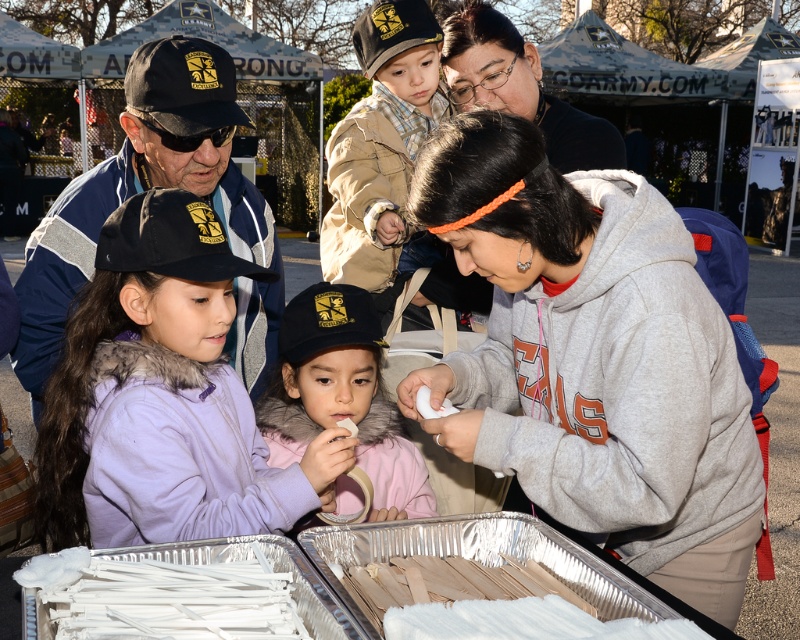
You are a photographer trying to capture a photo of the gray fleece hoodie at center and the black matte cap at upper left. Which object should you zoom in on to ensure both are clearly visible in the frame?

The gray fleece hoodie at center is smaller than the black matte cap at upper left, so you should zoom in on the smaller gray fleece hoodie at center to ensure both fit clearly in the frame.

You are a participant at the event and want to grab the white plastic straws at lower center to hand out drinks. However, you need to reach them while standing behind the matte black hoodie at upper center. Can you easily access the straws without moving the hoodie?

The white plastic straws at lower center are positioned on the left side of the matte black hoodie at upper center, so you can reach them by moving to the left side of the hoodie without needing to move it.

You are a photographer at the event and want to capture a clear photo of the pink fleece jacket at center without the gray fleece hoodie at center blocking it. What should you do?

The gray fleece hoodie at center is in front of the pink fleece jacket at center, so you should move the gray fleece hoodie at center out of the way or adjust your angle to avoid it to get a clear shot of the pink fleece jacket at center.